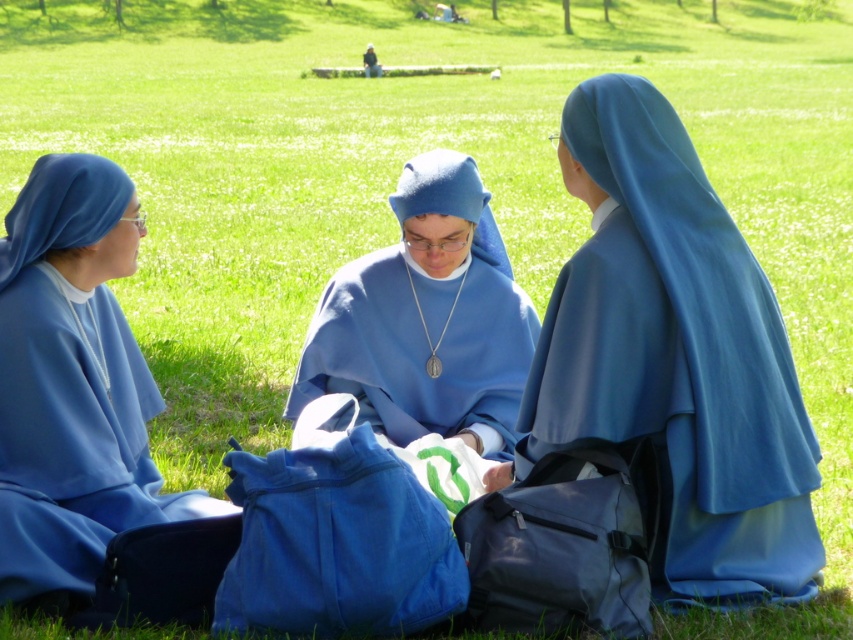
Question: Can you confirm if blue matte robe at center is positioned to the right of matte blue robe at left?

Choices:
 (A) no
 (B) yes

Answer: (B)

Question: Which object is the closest to the matte blue robe at center?

Choices:
 (A) blue matte robe at center
 (B) matte blue robe at left

Answer: (A)

Question: Which object is farther from the camera taking this photo?

Choices:
 (A) matte blue robe at center
 (B) blue matte robe at center
 (C) matte blue robe at left

Answer: (A)

Question: Which object appears farthest from the camera in this image?

Choices:
 (A) matte blue robe at left
 (B) matte blue robe at center

Answer: (B)

Question: Is matte blue robe at left above matte blue robe at center?

Choices:
 (A) yes
 (B) no

Answer: (B)

Question: Can you confirm if blue matte robe at center is positioned below matte blue robe at left?

Choices:
 (A) no
 (B) yes

Answer: (A)